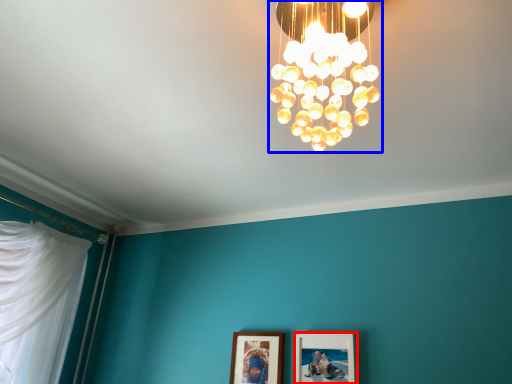
Question: Which point is closer to the camera, picture frame (highlighted by a red box) or lamp (highlighted by a blue box)?

Choices:
 (A) picture frame
 (B) lamp

Answer: (B)